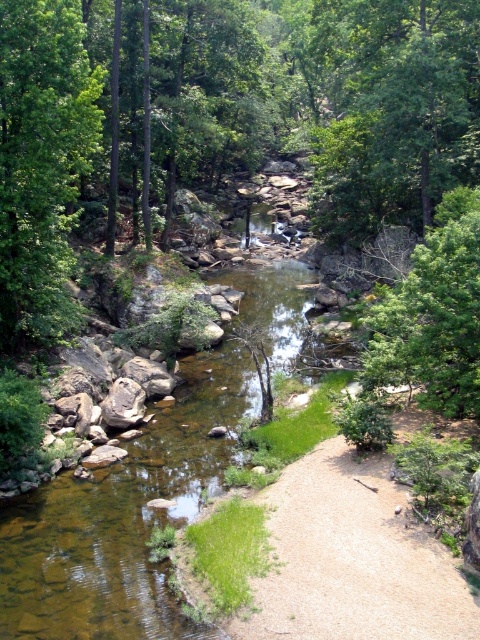
Question: Which point is closer to the camera?

Choices:
 (A) green leafy tree at center
 (B) green leafy tree at upper center
 (C) green leafy tree at left

Answer: (A)

Question: Which point appears closest to the camera in this image?

Choices:
 (A) (48, 323)
 (B) (441, 396)

Answer: (B)

Question: Among these objects, which one is nearest to the camera?

Choices:
 (A) green leafy tree at left
 (B) green leafy tree at center

Answer: (B)

Question: Is green leafy tree at upper center further to camera compared to green leafy tree at center?

Choices:
 (A) yes
 (B) no

Answer: (A)

Question: Where is green leafy tree at left located in relation to green leafy tree at center in the image?

Choices:
 (A) left
 (B) right

Answer: (A)

Question: Observing the image, what is the correct spatial positioning of green leafy tree at upper center in reference to green leafy tree at center?

Choices:
 (A) right
 (B) left

Answer: (A)